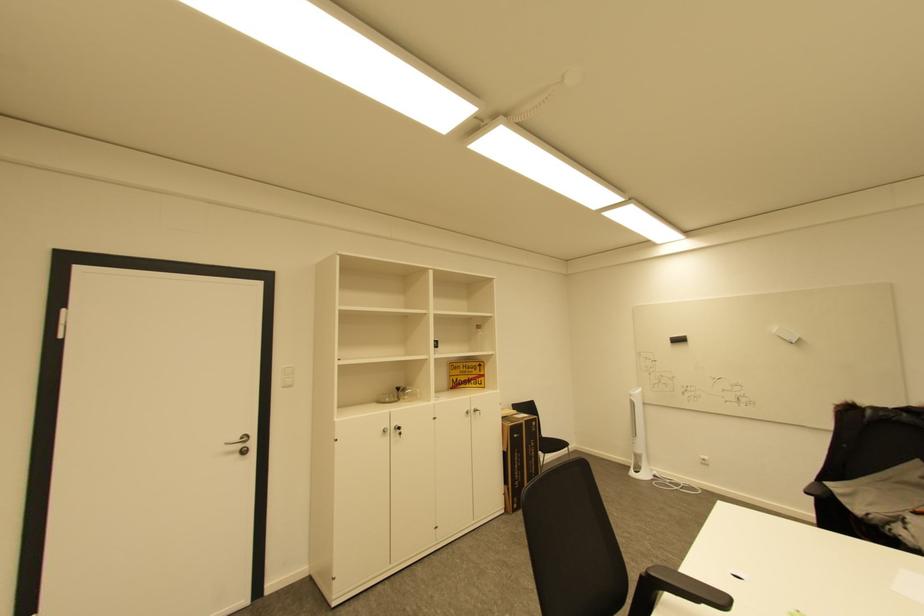
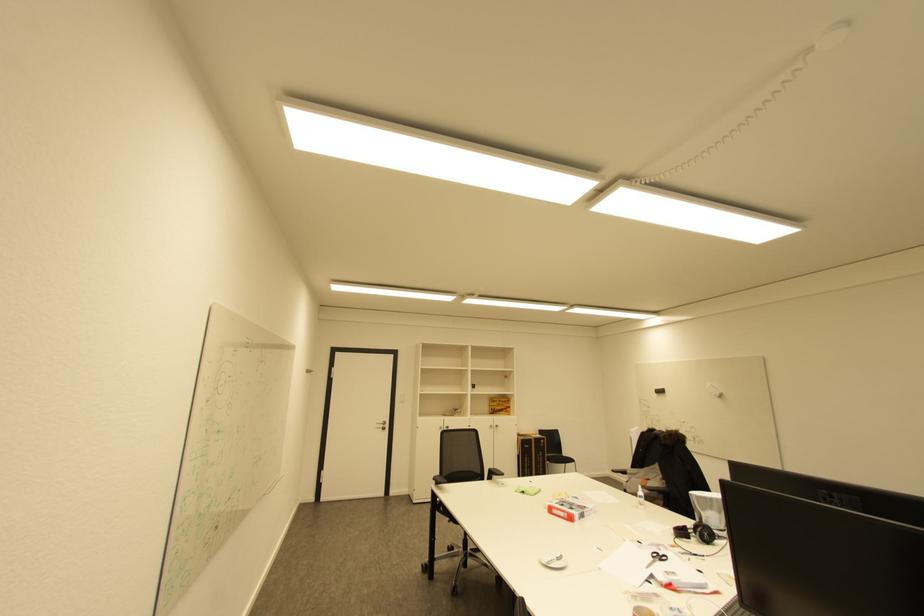
Locate, in the second image, the point that corresponds to the point at 531,422 in the first image.

(541, 439)